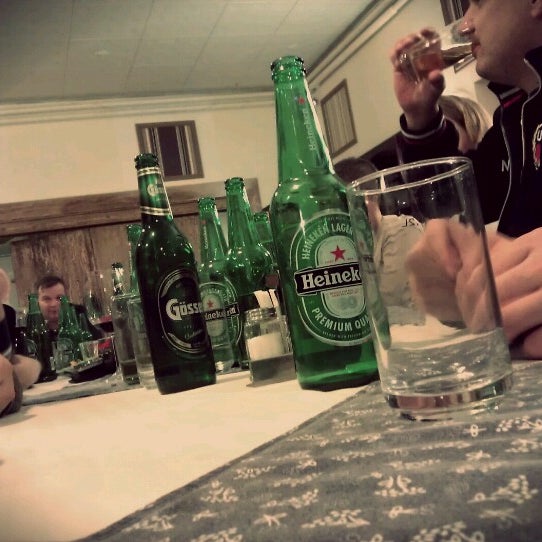
This screenshot has height=542, width=542. I want to click on ceiling, so click(196, 50).